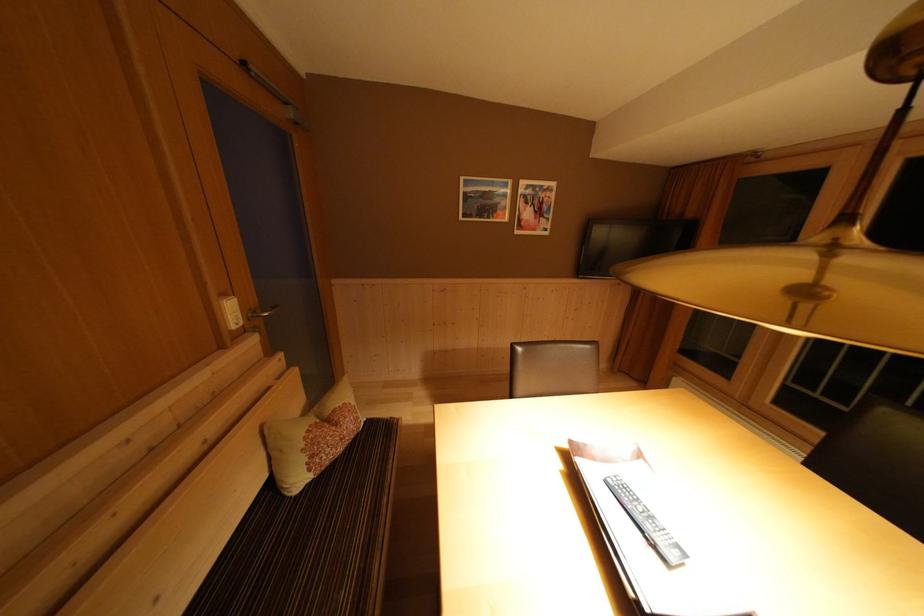
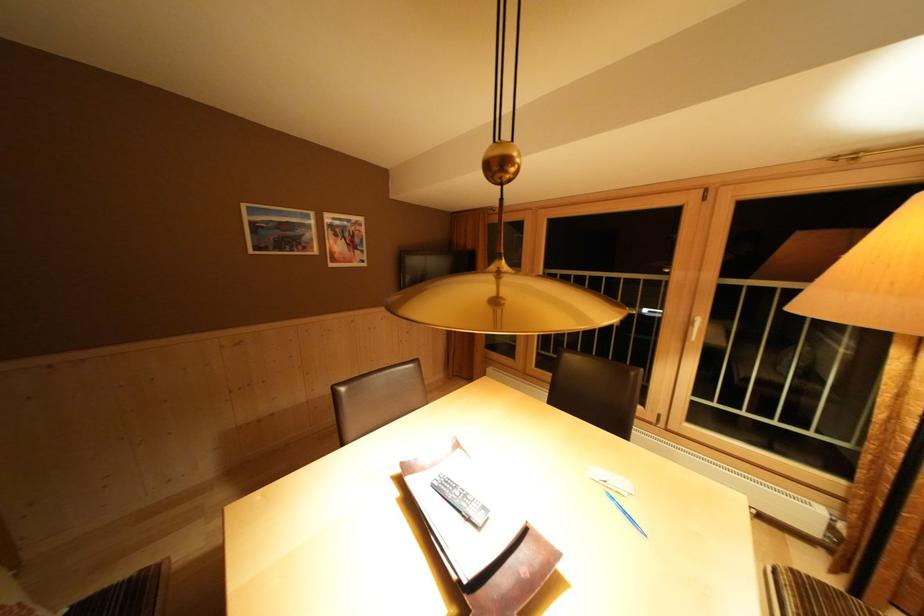
Question: How did the camera likely rotate?

Choices:
 (A) Left
 (B) Right
 (C) Up
 (D) Down

Answer: (B)